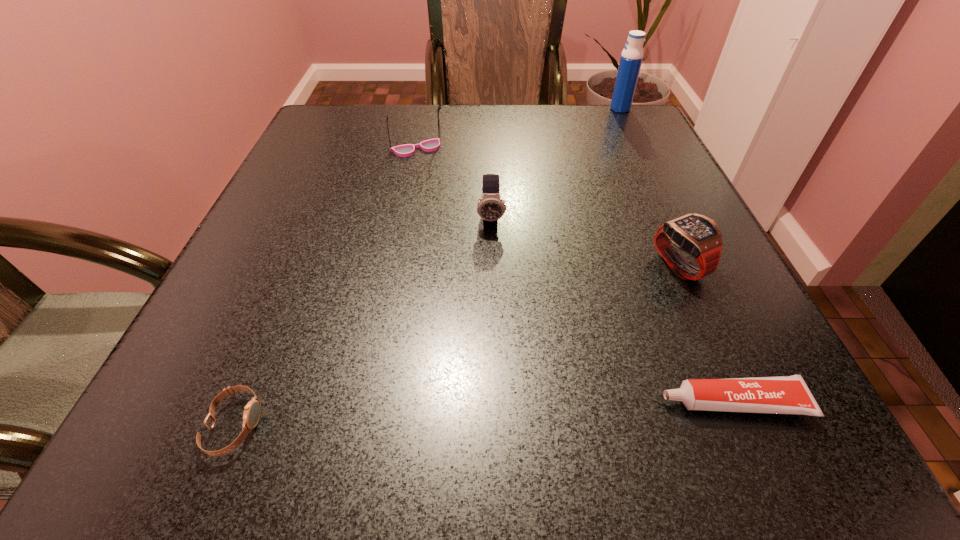
Locate an element on the screen. The image size is (960, 540). vacant space at the far edge of the desktop is located at coordinates (540, 126).

Where is `vacant space at the left edge of the desktop`? The height and width of the screenshot is (540, 960). vacant space at the left edge of the desktop is located at coordinates (285, 307).

What are the coordinates of `free space at the right edge` in the screenshot? It's located at (674, 330).

The height and width of the screenshot is (540, 960). I want to click on free space at the far left corner of the desktop, so (x=353, y=139).

This screenshot has height=540, width=960. I want to click on vacant space at the far right corner of the desktop, so click(655, 138).

The image size is (960, 540). Find the location of `free spot between the farthest watch and the toothpaste`. free spot between the farthest watch and the toothpaste is located at coordinates (612, 310).

Image resolution: width=960 pixels, height=540 pixels. Find the location of `free space that is in between the toothpaste and the third farthest object`. free space that is in between the toothpaste and the third farthest object is located at coordinates (612, 310).

I want to click on unoccupied position between the rightmost watch and the leftmost watch, so [x=457, y=346].

Image resolution: width=960 pixels, height=540 pixels. I want to click on vacant area between the farthest object and the shortest watch, so click(427, 267).

Find the location of `empty space that is in between the leftmost object and the fourth nearest object`. empty space that is in between the leftmost object and the fourth nearest object is located at coordinates (363, 322).